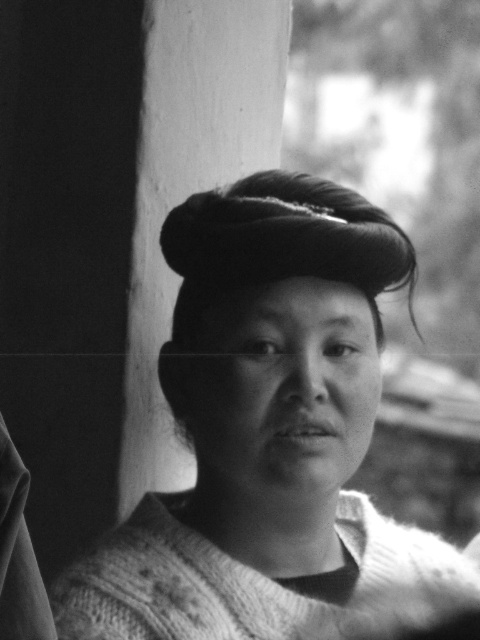
You are a fashion designer observing this image. You need to decide whether the knitted sweater at center and the dark matte hair bun at center can be seen simultaneously from the front view. Based on their positions, what do you think?

The knitted sweater at center is positioned under the dark matte hair bun at center, so yes, both can be seen from the front view since the sweater is below the hair bun and does not block it.

You are a tailor measuring a knitted sweater at center for alterations. The customer wants to know if the sweater is within the standard 36 inches length requirement. Can you determine this based on the image?

The knitted sweater at center is 35.36 inches from viewer, which is slightly shorter than the standard 36 inches length requirement.

You are a photographer adjusting the lighting to highlight the textures in the image. Since the knitted sweater at center and the dark matte hair bun at center are both at the center, which one is more to the right?

The knitted sweater at center is positioned on the right side of dark matte hair bun at center, so it is more to the right.